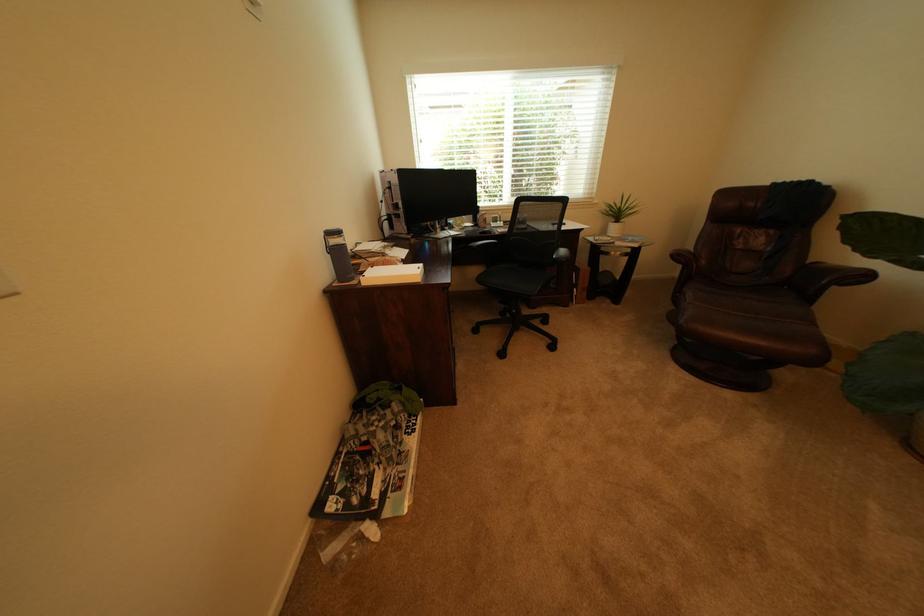
Image resolution: width=924 pixels, height=616 pixels. Find the location of `black chair sitting surface`. black chair sitting surface is located at coordinates (514, 278).